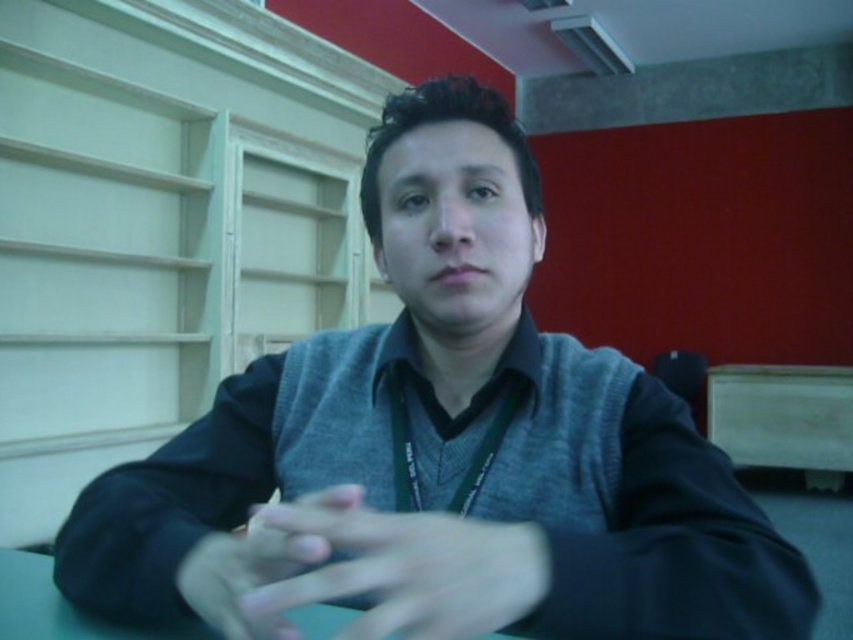
Question: Does smooth skin hand at center lie behind green matte table at center?

Choices:
 (A) no
 (B) yes

Answer: (A)

Question: Can you confirm if matte gray hand at center is positioned to the right of green matte table at center?

Choices:
 (A) yes
 (B) no

Answer: (A)

Question: Which object appears closest to the camera in this image?

Choices:
 (A) smooth skin hand at center
 (B) green matte table at center

Answer: (A)

Question: Which object is closer to the camera taking this photo?

Choices:
 (A) smooth skin hand at center
 (B) matte gray hand at center

Answer: (A)

Question: Estimate the real-world distances between objects in this image. Which object is farther from the smooth skin hand at center?

Choices:
 (A) green matte table at center
 (B) matte gray hand at center

Answer: (A)

Question: Can you confirm if smooth skin hand at center is positioned to the right of matte gray hand at center?

Choices:
 (A) no
 (B) yes

Answer: (B)